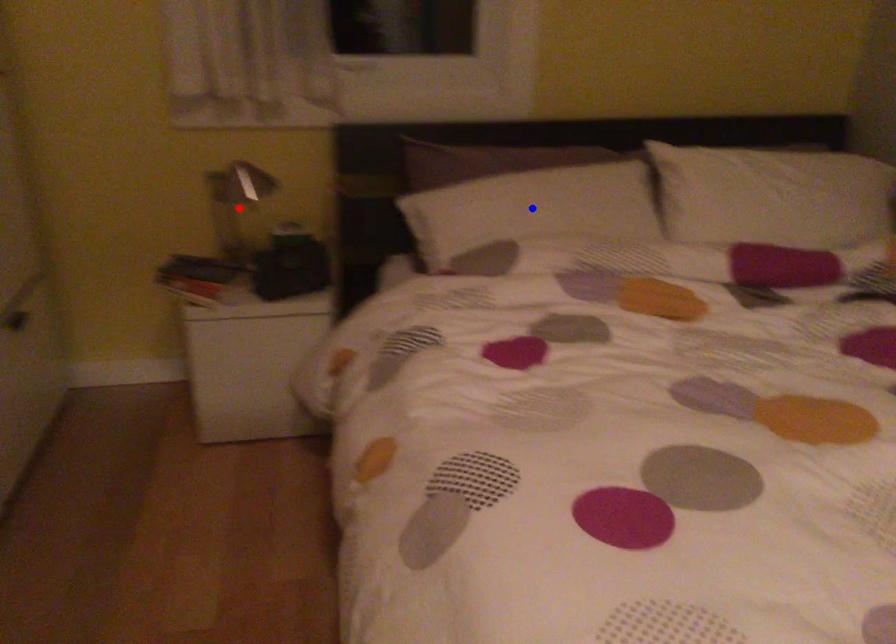
Question: In the image, two points are highlighted. Which point is nearer to the camera? Reply with the corresponding letter.

Choices:
 (A) blue point
 (B) red point

Answer: (A)